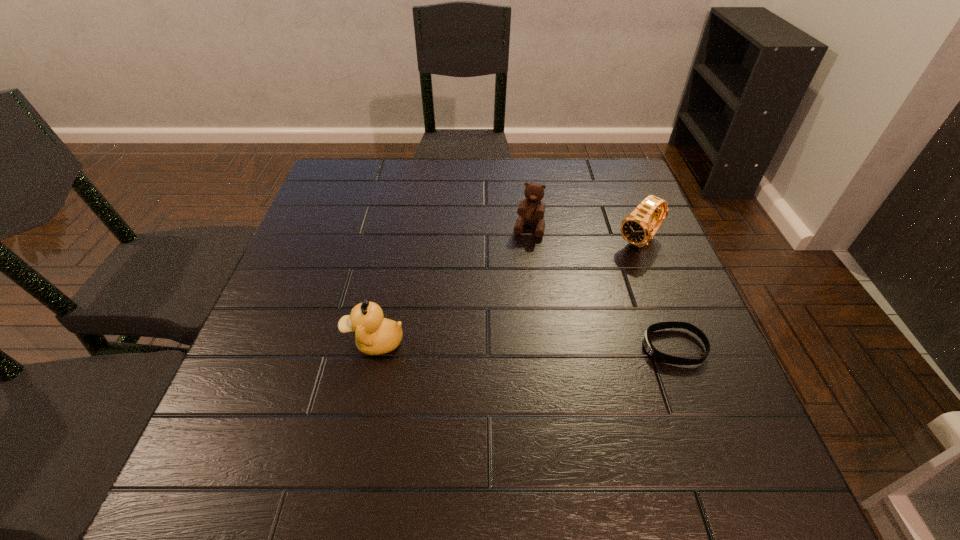
Identify the location of unoccupied position between the watch and the duckling. (507, 292).

You are a GUI agent. You are given a task and a screenshot of the screen. Output one action in this format:
    pyautogui.click(x=<x>, y=<y>)
    Task: Click on the unoccupied area between the duckling and the teddy bear
    
    Given the screenshot: What is the action you would take?
    pyautogui.click(x=452, y=286)

Locate an element on the screen. free space that is in between the duckling and the shortest object is located at coordinates [524, 345].

Locate an element on the screen. Image resolution: width=960 pixels, height=540 pixels. vacant space in between the shortest object and the watch is located at coordinates (657, 294).

Image resolution: width=960 pixels, height=540 pixels. I want to click on unoccupied area between the duckling and the third object from right to left, so click(x=452, y=286).

Where is `object that is the second closest one to the second object from left to right`? object that is the second closest one to the second object from left to right is located at coordinates [x=651, y=350].

Select which object appears as the third closest to the watch. Please provide its 2D coordinates. Your answer should be formatted as a tuple, i.e. [(x, y)], where the tuple contains the x and y coordinates of a point satisfying the conditions above.

[(374, 335)]

The height and width of the screenshot is (540, 960). Identify the location of vacant space that satisfies the following two spatial constraints: 1. on the front side of the second object from left to right; 2. on the display of the wristband. (543, 347).